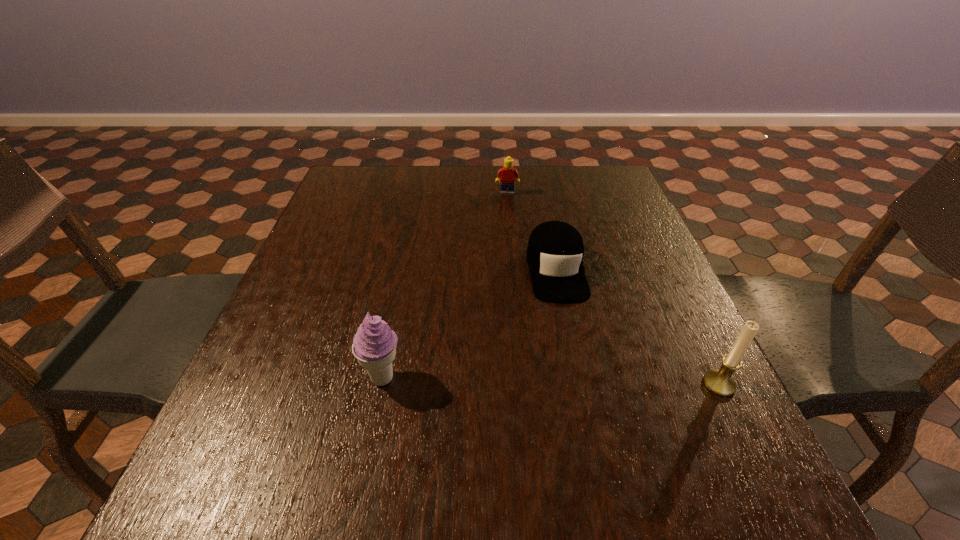
Find the location of a particular element. The image size is (960, 540). vacant area at the far left corner is located at coordinates (348, 176).

At what (x,y) coordinates should I click in order to perform the action: click on free space at the near left corner. Please return your answer as a coordinate pair (x, y). The height and width of the screenshot is (540, 960). Looking at the image, I should click on (219, 434).

Where is `free region at the far right corner of the desktop`? free region at the far right corner of the desktop is located at coordinates (590, 174).

Find the location of `vacant space at the near right corner`. vacant space at the near right corner is located at coordinates (710, 450).

At what (x,y) coordinates should I click in order to perform the action: click on vacant space that is in between the rightmost object and the cap. Please return your answer as a coordinate pair (x, y). Image resolution: width=960 pixels, height=540 pixels. Looking at the image, I should click on pos(637,327).

At what (x,y) coordinates should I click in order to perform the action: click on vacant region between the rightmost object and the cap. Please return your answer as a coordinate pair (x, y). This screenshot has height=540, width=960. Looking at the image, I should click on (637, 327).

At what (x,y) coordinates should I click in order to perform the action: click on free space between the icecream and the Lego. Please return your answer as a coordinate pair (x, y). The height and width of the screenshot is (540, 960). Looking at the image, I should click on [444, 286].

Locate an element on the screen. blank region between the second shortest object and the cap is located at coordinates (531, 231).

Identify the location of free space that is in between the cap and the Lego. (531, 231).

Where is `free space between the rightmost object and the icecream`? The image size is (960, 540). free space between the rightmost object and the icecream is located at coordinates (551, 381).